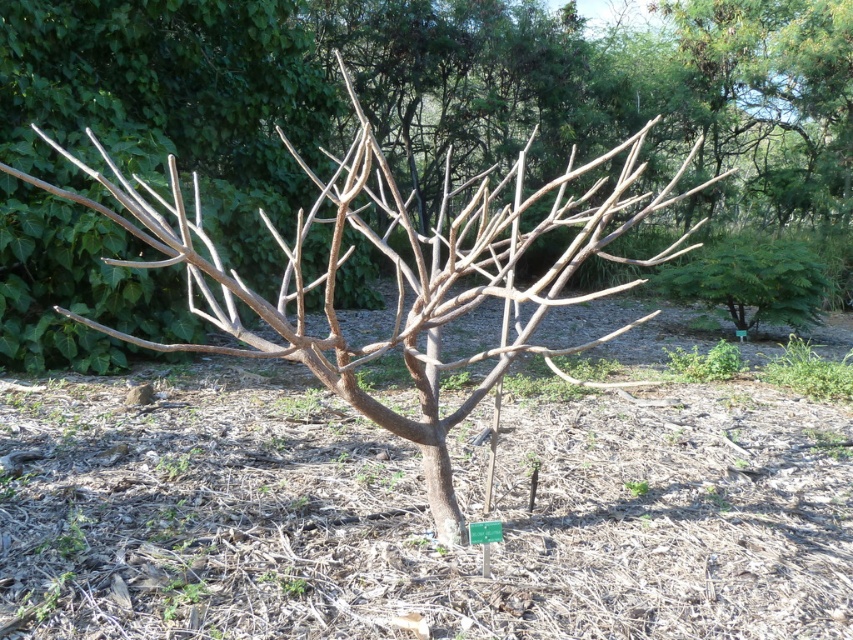
Is green grass at lower right to the right of brown woody branch at center from the viewer's perspective?

Correct, you'll find green grass at lower right to the right of brown woody branch at center.

Can you confirm if green grass at lower right is wider than brown woody branch at center?

Yes.

Between point (828, 381) and point (639, 481), which one is positioned behind?

The point (828, 381) is more distant.

Locate an element on the screen. The width and height of the screenshot is (853, 640). green grass at lower right is located at coordinates (809, 371).

Is brown dirt at center to the right of brown woody branch at center from the viewer's perspective?

No, brown dirt at center is not to the right of brown woody branch at center.

Who is taller, brown dirt at center or brown woody branch at center?

Standing taller between the two is brown dirt at center.

Locate an element on the screen. The image size is (853, 640). brown dirt at center is located at coordinates (416, 515).

The width and height of the screenshot is (853, 640). What do you see at coordinates (438, 96) in the screenshot?
I see `brown rough tree at center` at bounding box center [438, 96].

Between brown rough tree at center and green grass at lower right, which one appears on the right side from the viewer's perspective?

green grass at lower right is more to the right.

Between point (769, 204) and point (836, 392), which one is positioned in front?

Point (836, 392) is in front.

I want to click on brown rough tree at center, so click(x=438, y=96).